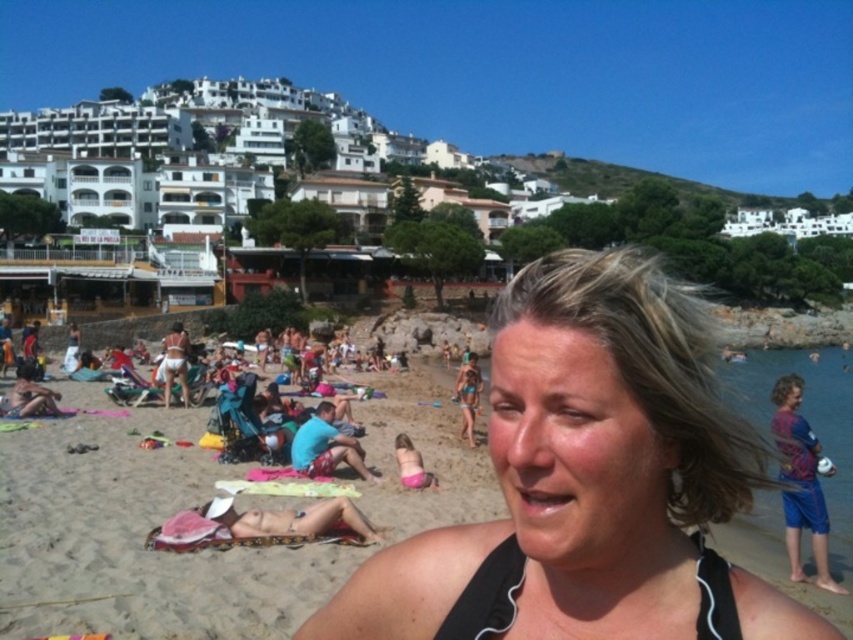
Question: Does black swimsuit at center appear over black fabric bikini top at lower center?

Choices:
 (A) yes
 (B) no

Answer: (A)

Question: Which point is closer to the camera?

Choices:
 (A) black swimsuit at center
 (B) blue fabric shorts at right

Answer: (A)

Question: Is black fabric bikini top at lower center smaller than blue fabric shorts at right?

Choices:
 (A) yes
 (B) no

Answer: (A)

Question: Which point is closer to the camera?

Choices:
 (A) (791, 513)
 (B) (708, 604)

Answer: (B)

Question: Which object is closer to the camera taking this photo?

Choices:
 (A) black swimsuit at center
 (B) blue fabric shorts at right

Answer: (A)

Question: Does black swimsuit at center appear on the right side of black fabric bikini top at lower center?

Choices:
 (A) yes
 (B) no

Answer: (A)